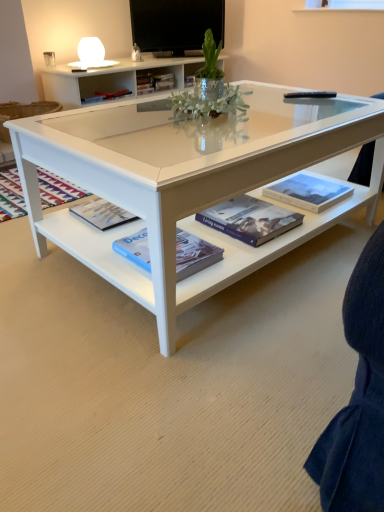
Question: Considering the positions of hardcover book at center, the third book when ordered from bottom to top, and hardcover book at center, marked as the 3th book in a back-to-front arrangement, in the image, is hardcover book at center, the third book when ordered from bottom to top, wider or thinner than hardcover book at center, marked as the 3th book in a back-to-front arrangement,?

Choices:
 (A) wide
 (B) thin

Answer: (B)

Question: From a real-world perspective, is hardcover book at center, marked as the 1th book in a right-to-left arrangement, positioned above or below hardcover book at center, arranged as the 3th book when viewed from the left?

Choices:
 (A) below
 (B) above

Answer: (B)

Question: Which object is the closest to the white glossy coffee table at center?

Choices:
 (A) hardcover book at lower left
 (B) blue hardcover book at center, the 4th book when ordered from top to bottom
 (C) hardcover book at center, marked as the 1th book in a right-to-left arrangement
 (D) hardcover book at center, which is the fourth book in front-to-back order
 (E) flat screen tv at upper center

Answer: (B)

Question: Which object is positioned farthest from the hardcover book at lower left?

Choices:
 (A) blue hardcover book at center, which ranks as the fourth book in back-to-front order
 (B) hardcover book at center, placed as the 3th book when sorted from top to bottom
 (C) flat screen tv at upper center
 (D) green glass vase at center
 (E) white glossy coffee table at center

Answer: (C)